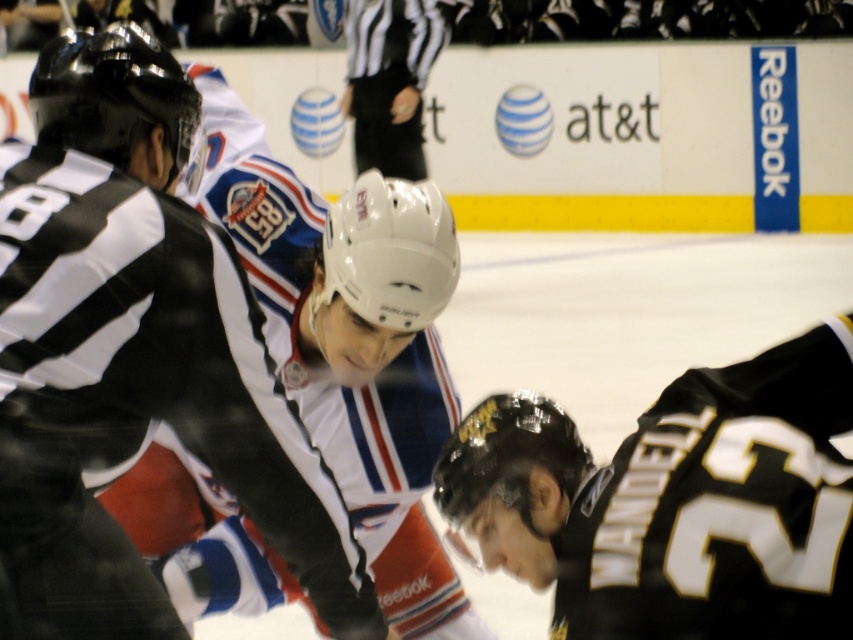
What do you see at coordinates (132, 352) in the screenshot? This screenshot has width=853, height=640. I see `white matte jersey at center` at bounding box center [132, 352].

Does white matte jersey at center have a greater width compared to white matte helmet at upper center?

No, white matte jersey at center is not wider than white matte helmet at upper center.

Identify the location of white matte jersey at center. The image size is (853, 640). (132, 352).

Can you confirm if black matte jersey at lower right is taller than white matte helmet at upper center?

Incorrect, black matte jersey at lower right's height is not larger of white matte helmet at upper center's.

Who is taller, black matte jersey at lower right or white matte helmet at upper center?

white matte helmet at upper center is taller.

Between point (509, 488) and point (352, 35), which one is positioned behind?

Positioned behind is point (352, 35).

Identify the location of black matte jersey at lower right. The height and width of the screenshot is (640, 853). (672, 500).

Which of these two, white matte jersey at center or black matte jersey at lower right, stands taller?

white matte jersey at center is taller.

Where is `white matte jersey at center`? The width and height of the screenshot is (853, 640). white matte jersey at center is located at coordinates (132, 352).